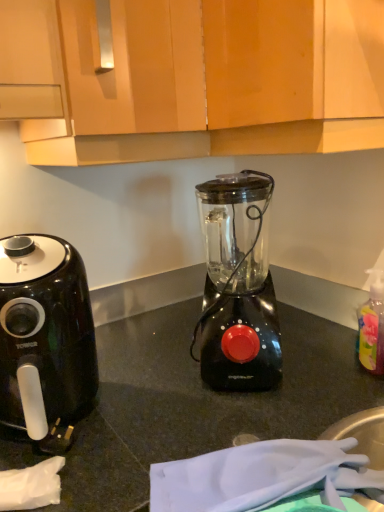
Question: Can you confirm if wooden cabinet at upper center is taller than black plastic air fryer at left?

Choices:
 (A) yes
 (B) no

Answer: (A)

Question: Is wooden cabinet at upper center positioned far away from black plastic air fryer at left?

Choices:
 (A) yes
 (B) no

Answer: (B)

Question: From the image's perspective, is wooden cabinet at upper center located beneath black plastic air fryer at left?

Choices:
 (A) no
 (B) yes

Answer: (A)

Question: Is wooden cabinet at upper center wider than black plastic air fryer at left?

Choices:
 (A) no
 (B) yes

Answer: (B)

Question: From a real-world perspective, is wooden cabinet at upper center on black plastic air fryer at left?

Choices:
 (A) no
 (B) yes

Answer: (B)

Question: Could you tell me if wooden cabinet at upper center is facing black plastic air fryer at left?

Choices:
 (A) yes
 (B) no

Answer: (B)

Question: Is black plastic blender at center to the left of black plastic air fryer at left from the viewer's perspective?

Choices:
 (A) yes
 (B) no

Answer: (B)

Question: From a real-world perspective, is black plastic blender at center over black plastic air fryer at left?

Choices:
 (A) yes
 (B) no

Answer: (A)

Question: From the image's perspective, is black plastic blender at center on black plastic air fryer at left?

Choices:
 (A) no
 (B) yes

Answer: (B)

Question: Is black plastic blender at center positioned far away from black plastic air fryer at left?

Choices:
 (A) no
 (B) yes

Answer: (A)

Question: Is black plastic blender at center further to camera compared to black plastic air fryer at left?

Choices:
 (A) yes
 (B) no

Answer: (A)

Question: Is black plastic blender at center oriented away from black plastic air fryer at left?

Choices:
 (A) yes
 (B) no

Answer: (B)

Question: Does translucent plastic bottle at right have a greater height compared to black plastic air fryer at left?

Choices:
 (A) no
 (B) yes

Answer: (A)